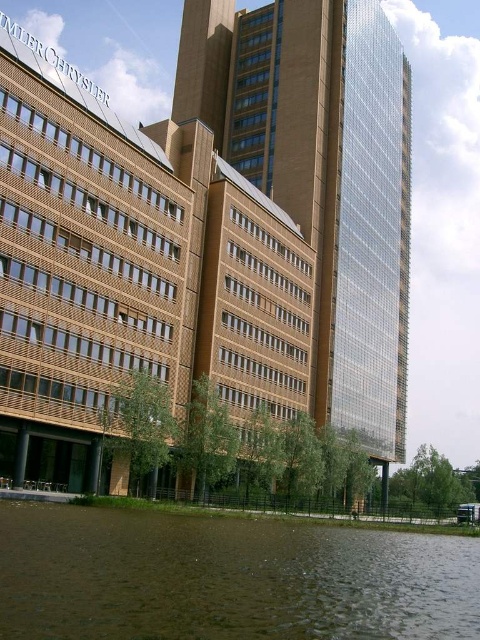
Question: Can you confirm if glassy reflective tower at center is positioned to the left of brown murky water at lower center?

Choices:
 (A) yes
 (B) no

Answer: (B)

Question: Is glassy reflective tower at center further to the viewer compared to brown murky water at lower center?

Choices:
 (A) yes
 (B) no

Answer: (A)

Question: Can you confirm if glassy reflective tower at center is wider than brown murky water at lower center?

Choices:
 (A) no
 (B) yes

Answer: (B)

Question: Among these points, which one is farthest from the camera?

Choices:
 (A) (296, 620)
 (B) (396, 326)

Answer: (B)